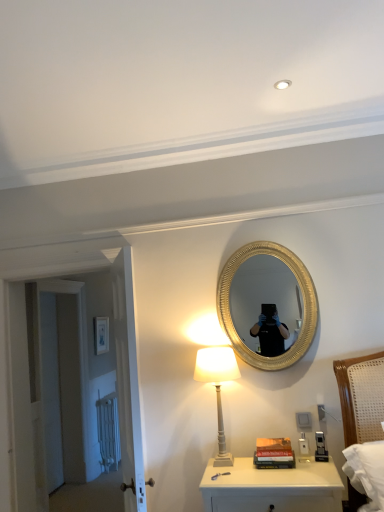
At what (x,y) coordinates should I click in order to perform the action: click on vacant region in front of white painted wood table lamp at lower center. Please return your answer as a coordinate pair (x, y). The width and height of the screenshot is (384, 512). Looking at the image, I should click on (243, 476).